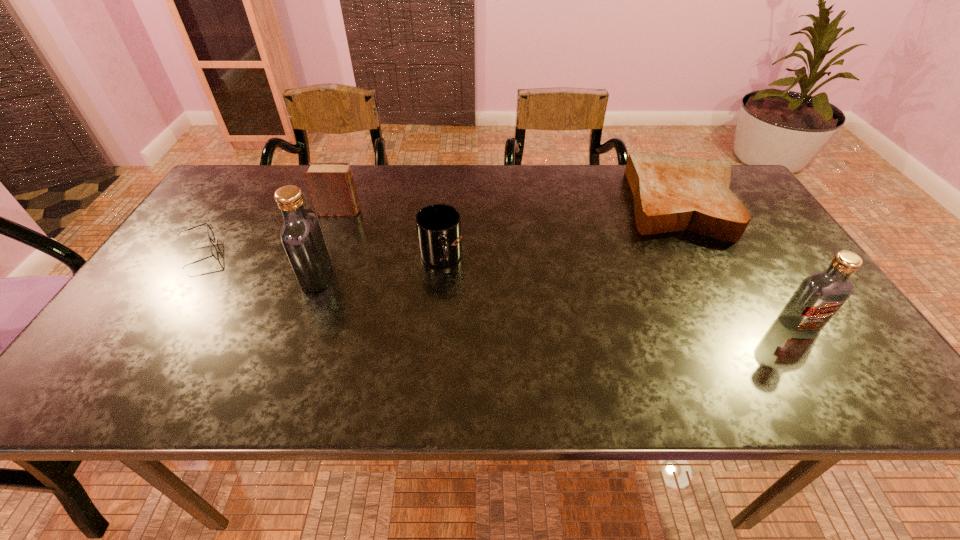
Locate an element on the screen. free space located 0.080m on the front-facing side of the left vodka is located at coordinates (270, 278).

Find the location of a particular element. The image size is (960, 540). free region located 0.070m on the front-facing side of the left vodka is located at coordinates (275, 278).

I want to click on vacant space situated on the front-facing side of the left vodka, so click(x=168, y=278).

Identify the location of vacant space positioned 0.160m on the front of the second shortest object. (729, 287).

I want to click on free space located with the handle on the side of the fourth tallest object, so click(432, 353).

What are the coordinates of `vacant space located 0.070m on the spine side of the third tallest object` in the screenshot? It's located at (385, 212).

At what (x,y) coordinates should I click in order to perform the action: click on blank area located with the lenses facing outward on the leftmost object. Please return your answer as a coordinate pair (x, y). The height and width of the screenshot is (540, 960). Looking at the image, I should click on (266, 253).

The image size is (960, 540). What are the coordinates of `bread that is at the far edge` in the screenshot? It's located at (671, 193).

Locate an element on the screen. diary that is positioned at the far edge is located at coordinates (331, 185).

Image resolution: width=960 pixels, height=540 pixels. Find the location of `object that is at the near edge`. object that is at the near edge is located at coordinates (820, 295).